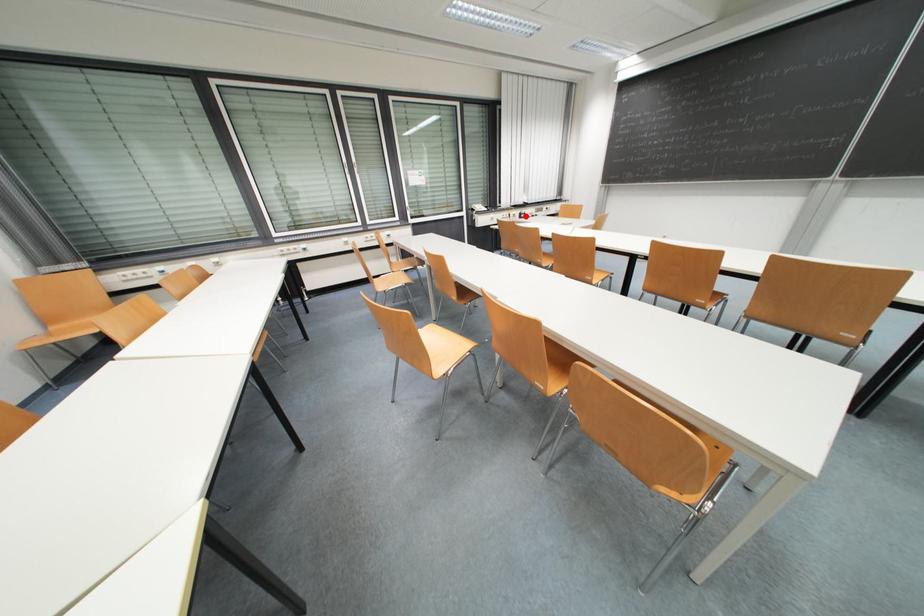
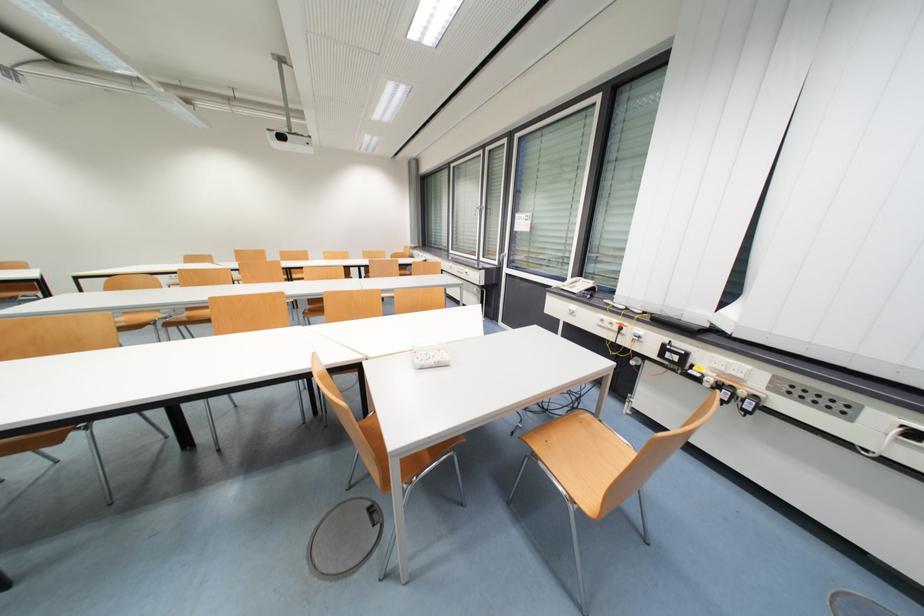
Question: I am providing you with two images of the same scene from different viewpoints. Given a red point in image1, look at the same physical point in image2. Is it:

Choices:
 (A) Closer to the viewpoint
 (B) Farther from the viewpoint

Answer: (B)